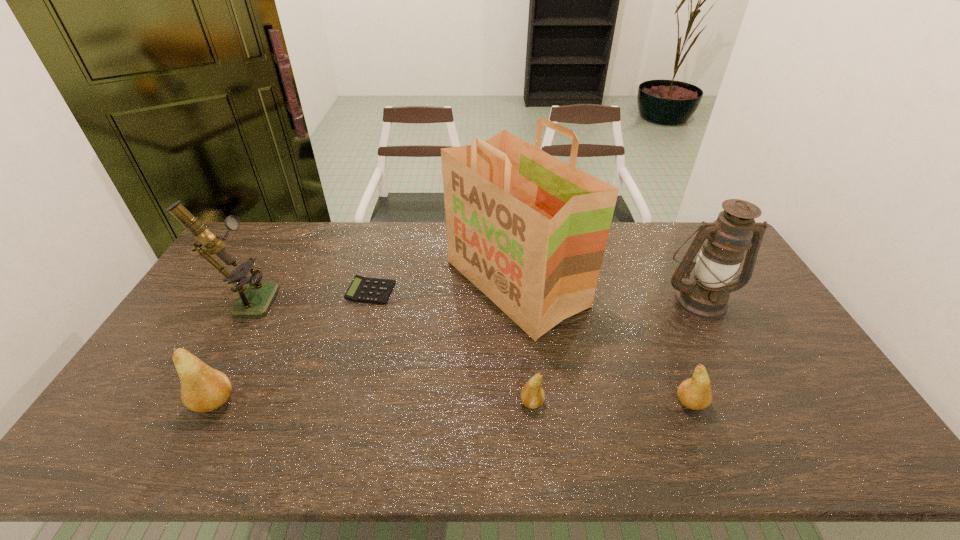
In order to click on vacant space that satisfies the following two spatial constraints: 1. on the back side of the leftmost pear; 2. on the left side of the grocery bag in this screenshot , I will do `click(276, 283)`.